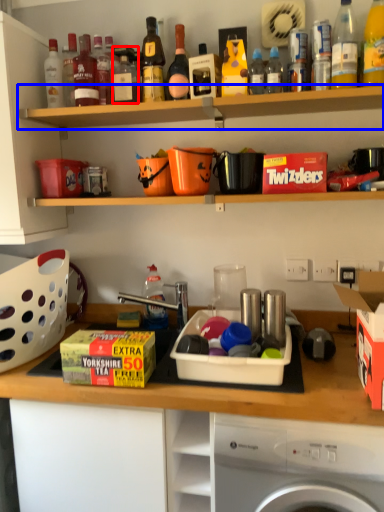
Question: Which of the following is the farthest to the observer, bottle (highlighted by a red box) or shelf (highlighted by a blue box)?

Choices:
 (A) bottle
 (B) shelf

Answer: (A)